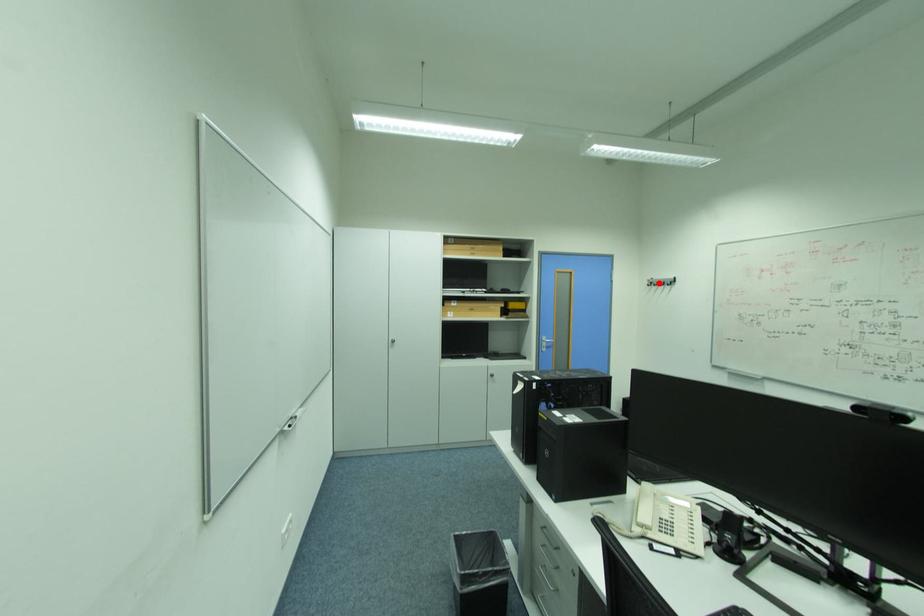
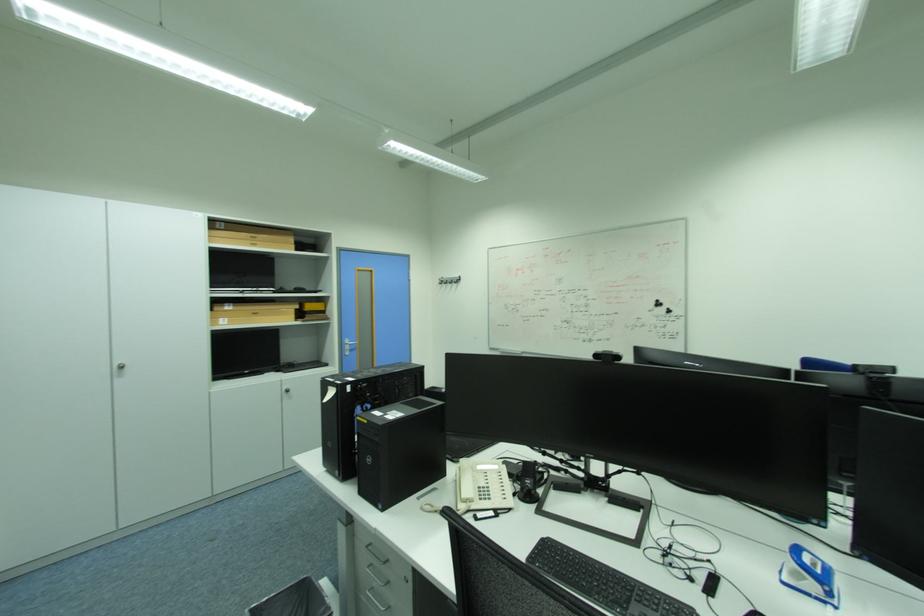
The point at the highlighted location is marked in the first image. Where is the corresponding point in the second image?

(448, 282)